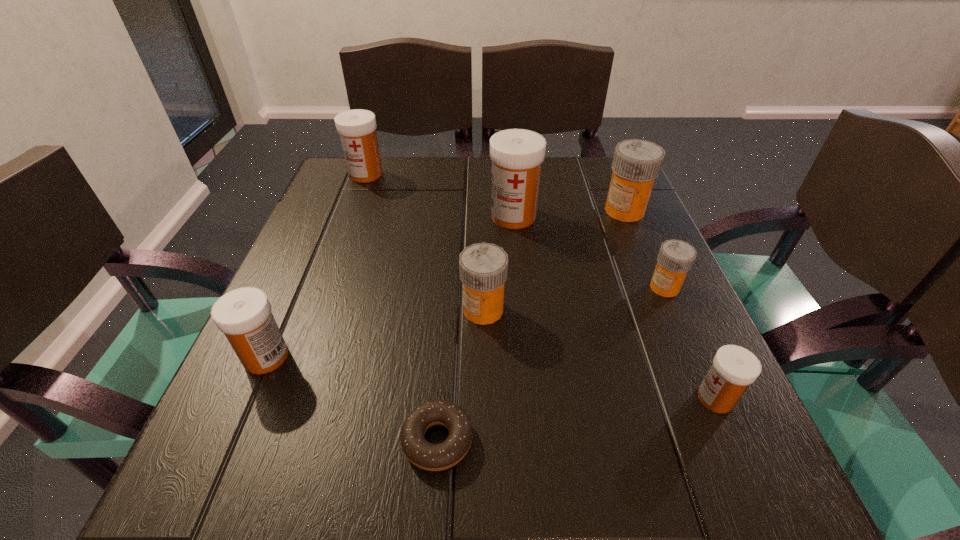
At what (x,y) coordinates should I click in order to perform the action: click on free spot between the tallest object and the nearest medicine. Please return your answer as a coordinate pair (x, y). This screenshot has width=960, height=540. Looking at the image, I should click on (614, 307).

I want to click on unoccupied area between the second nearest medicine and the farthest white medicine, so click(x=316, y=266).

The width and height of the screenshot is (960, 540). What are the coordinates of `unoccupied area between the leftmost orange medicine and the farthest object` in the screenshot? It's located at (424, 242).

Locate which object ranks fifth in proximity to the farthest medicine. Please provide its 2D coordinates. Your answer should be formatted as a tuple, i.e. [(x, y)], where the tuple contains the x and y coordinates of a point satisfying the conditions above.

[(432, 457)]

In order to click on object that ranks as the fourth closest to the sixth farthest object in this screenshot , I will do `click(357, 128)`.

Where is `the third closest medicine to the second nearest white medicine`? the third closest medicine to the second nearest white medicine is located at coordinates (357, 128).

Identify which medicine is the second closest to the tallest object. Please provide its 2D coordinates. Your answer should be formatted as a tuple, i.e. [(x, y)], where the tuple contains the x and y coordinates of a point satisfying the conditions above.

[(483, 267)]

I want to click on white medicine that is the closest to the second biggest white medicine, so click(517, 154).

The width and height of the screenshot is (960, 540). In order to click on white medicine that is the nearest to the tallest object in this screenshot , I will do `click(357, 128)`.

Point out which orange medicine is positioned as the nearest to the smallest white medicine. Please provide its 2D coordinates. Your answer should be formatted as a tuple, i.e. [(x, y)], where the tuple contains the x and y coordinates of a point satisfying the conditions above.

[(676, 257)]